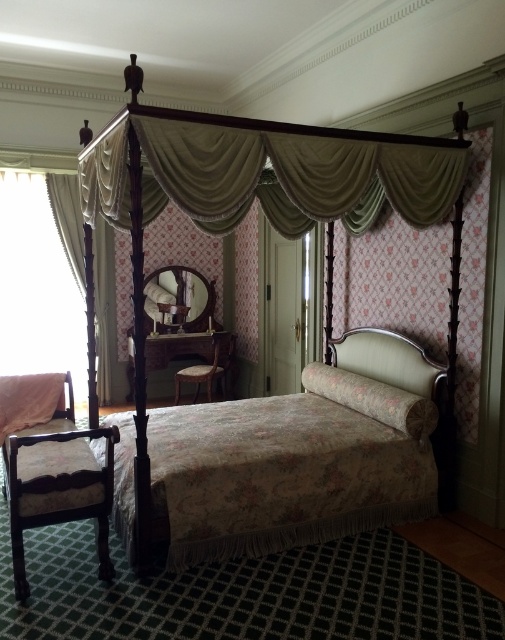
Question: Estimate the real-world distances between objects in this image. Which object is farther from the matte cream headboard at center?

Choices:
 (A) white sheer curtain at left
 (B) floral fabric bed at center
 (C) silky cream drapes at center
 (D) floral fabric canopy bed at center

Answer: (A)

Question: Is silky cream drapes at center closer to the viewer compared to matte cream headboard at center?

Choices:
 (A) no
 (B) yes

Answer: (B)

Question: Does floral fabric bed at center appear on the left side of silky cream drapes at center?

Choices:
 (A) yes
 (B) no

Answer: (B)

Question: Which point is farther from the camera taking this photo?

Choices:
 (A) (378, 376)
 (B) (132, 294)
 (C) (202, 560)
 (D) (372, 160)

Answer: (A)

Question: Among these points, which one is farthest from the camera?

Choices:
 (A) (340, 356)
 (B) (75, 212)
 (C) (235, 131)
 (D) (306, 417)

Answer: (B)

Question: Is floral fabric bed at center wider than floral fabric canopy bed at center?

Choices:
 (A) no
 (B) yes

Answer: (A)